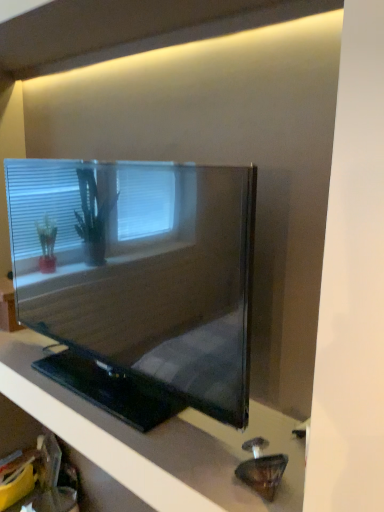
Question: From the image's perspective, is matte black tv at center above or below black glossy tv at center?

Choices:
 (A) above
 (B) below

Answer: (A)

Question: Which is correct: matte black tv at center is inside black glossy tv at center, or outside of it?

Choices:
 (A) outside
 (B) inside

Answer: (A)

Question: Considering the positions of matte black tv at center and black glossy tv at center in the image, is matte black tv at center wider or thinner than black glossy tv at center?

Choices:
 (A) wide
 (B) thin

Answer: (B)

Question: Is point (92, 451) positioned closer to the camera than point (160, 212)?

Choices:
 (A) farther
 (B) closer

Answer: (A)

Question: Is black glossy tv at center to the left or to the right of matte black tv at center in the image?

Choices:
 (A) right
 (B) left

Answer: (B)

Question: Looking at their shapes, would you say black glossy tv at center is wider or thinner than matte black tv at center?

Choices:
 (A) thin
 (B) wide

Answer: (B)

Question: In the image, is black glossy tv at center positioned in front of or behind matte black tv at center?

Choices:
 (A) behind
 (B) front

Answer: (B)